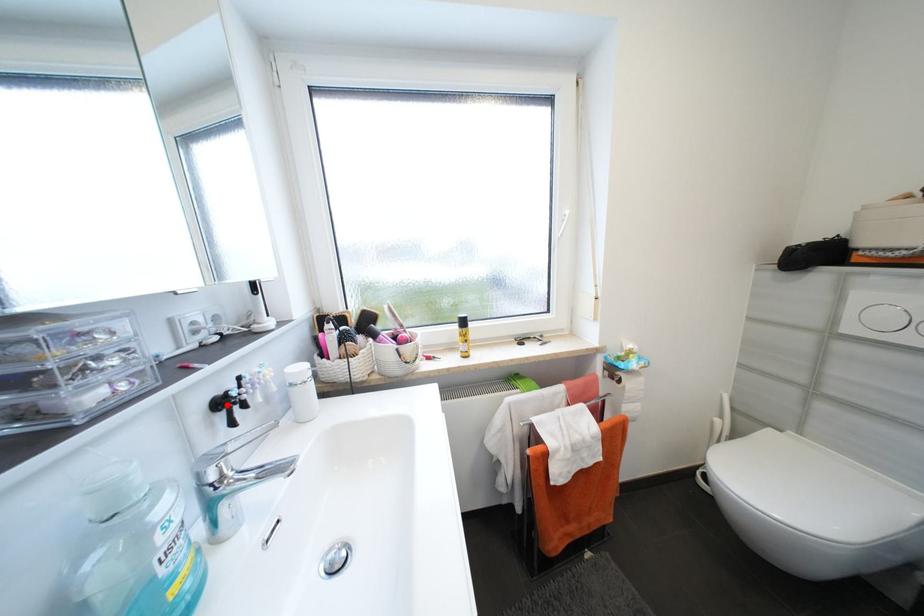
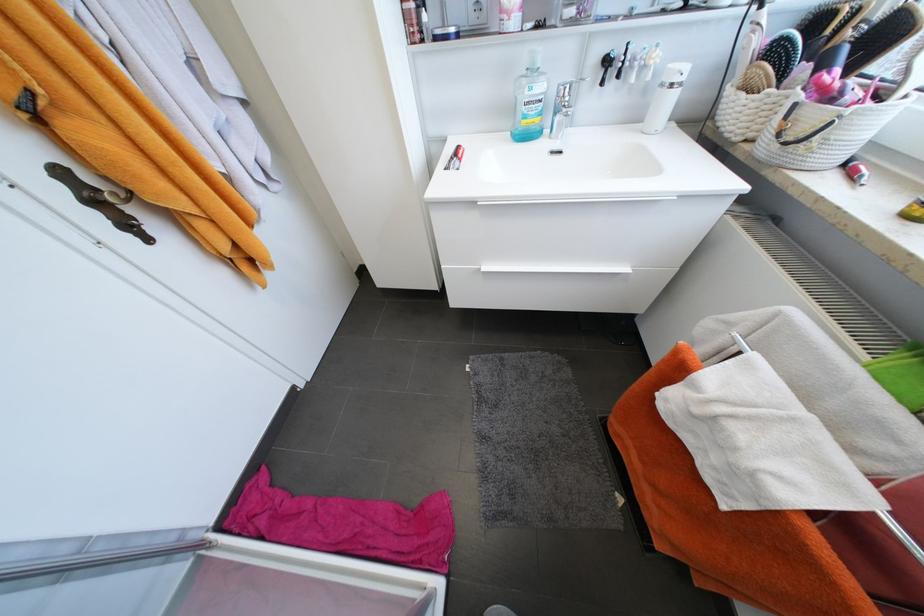
The point at the highlighted location is marked in the first image. Where is the corresponding point in the second image?

(613, 62)